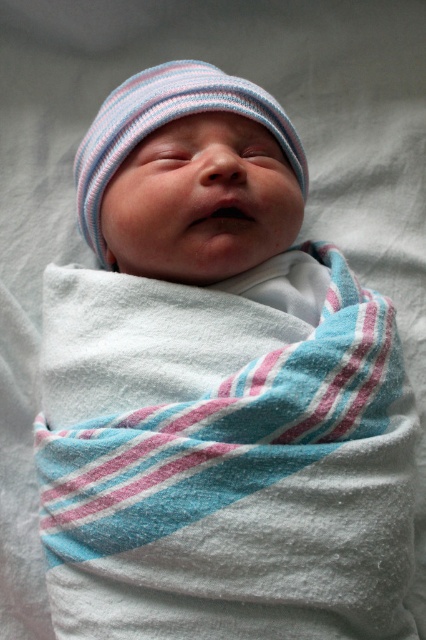
You are a photographer adjusting the focus on your camera. You need to focus on either the point at point (334, 477) or the point at point (249, 93). Which point should you choose to ensure the baby is in focus?

You should focus on point (334, 477) because it is closer to the camera than point (249, 93), ensuring the baby is in focus.

You are a photographer setting up a newborn photoshoot. You have a white soft blanket at center and a striped knit hat at center in the scene. Which object is wider?

The white soft blanket at center is wider than the striped knit hat at center because the white soft blanket at center has a greater width.

You are a nurse in a hospital nursery. You need to place the white soft blanket at center and the striped knit hat at center into a storage bin that can only hold items within 12 inches of each other. Can both items fit into the bin without exceeding the distance limit?

The white soft blanket at center is 12.47 inches away from the striped knit hat at center. Since the bin requires items to be within 12 inches of each other, the distance between them exceeds the limit. Therefore, they cannot both fit into the bin without violating the distance requirement.